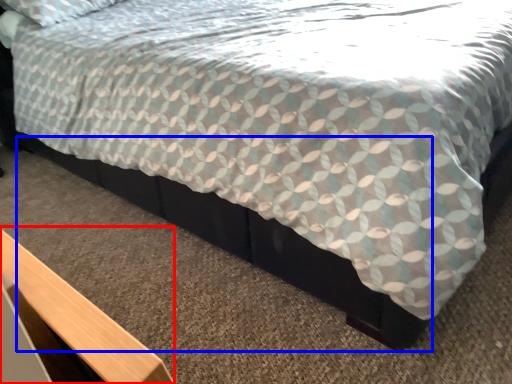
Question: Which of the following is the farthest to the observer, table (highlighted by a red box) or bed frame (highlighted by a blue box)?

Choices:
 (A) table
 (B) bed frame

Answer: (B)